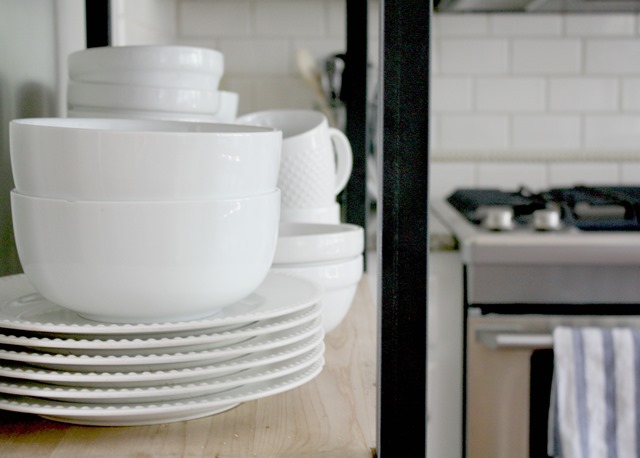
Locate an element on the screen. The width and height of the screenshot is (640, 458). white bowls is located at coordinates (137, 264), (153, 184), (157, 107), (164, 73), (330, 285), (324, 237).